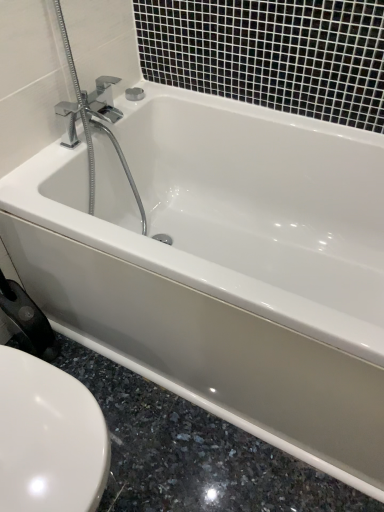
What is the approximate width of black matte towel bar at lower left?

black matte towel bar at lower left is 6.67 inches wide.

The width and height of the screenshot is (384, 512). Describe the element at coordinates (27, 321) in the screenshot. I see `black matte towel bar at lower left` at that location.

What are the coordinates of `black matte towel bar at lower left` in the screenshot? It's located at (27, 321).

What is the approximate height of black matte towel bar at lower left?

black matte towel bar at lower left is 17.56 inches in height.

Find the location of a particular element. This screenshot has width=384, height=512. black matte towel bar at lower left is located at coordinates (27, 321).